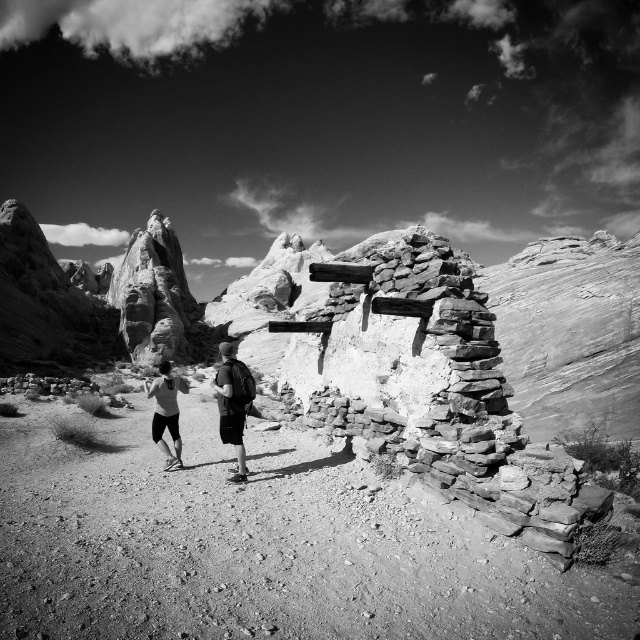
You are planning to carry both the matte black backpacks at center and the dark gray backpack at center during a desert hike. Given the desert environment, which backpack would be more suitable to carry essential items based on their sizes?

The matte black backpacks at center is larger in size than the dark gray backpack at center, so it would be more suitable for carrying essential items during a desert hike due to its greater capacity.